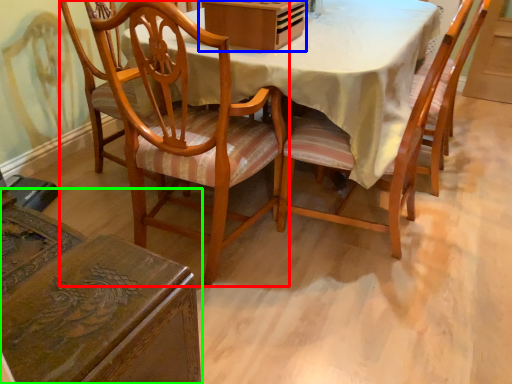
Question: Based on their relative distances, which object is farther from chair (highlighted by a red box)? Choose from box (highlighted by a blue box) and chair (highlighted by a green box).

Choices:
 (A) box
 (B) chair

Answer: (B)